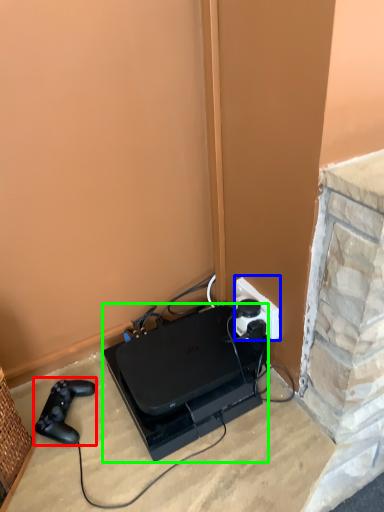
Question: Which is nearer to the game controller (highlighted by a red box)? power plugs and sockets (highlighted by a blue box) or appliance (highlighted by a green box).

Choices:
 (A) power plugs and sockets
 (B) appliance

Answer: (B)